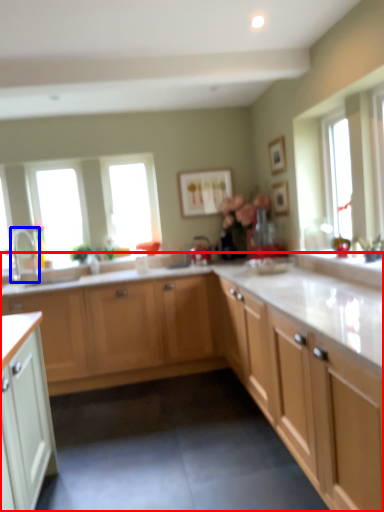
Question: Which point is further to the camera, cabinetry (highlighted by a red box) or tap (highlighted by a blue box)?

Choices:
 (A) cabinetry
 (B) tap

Answer: (B)